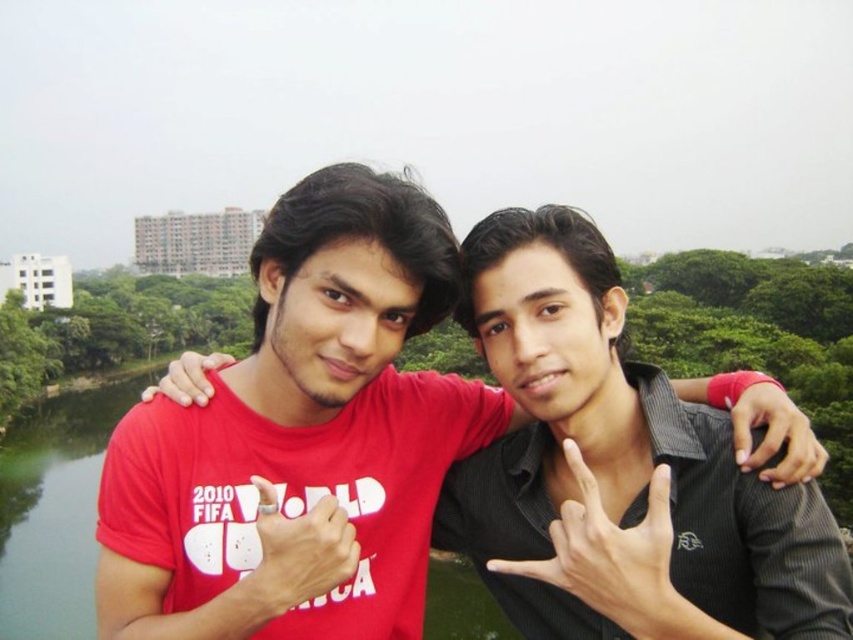
Question: Among these objects, which one is farthest from the camera?

Choices:
 (A) matte red t-shirt at center
 (B) black matte shirt at center

Answer: (A)

Question: Does matte red t-shirt at center have a larger size compared to black matte shirt at center?

Choices:
 (A) yes
 (B) no

Answer: (A)

Question: Can you confirm if matte red t-shirt at center is positioned above black matte shirt at center?

Choices:
 (A) yes
 (B) no

Answer: (A)

Question: Does matte red t-shirt at center appear on the left side of black matte shirt at center?

Choices:
 (A) no
 (B) yes

Answer: (B)